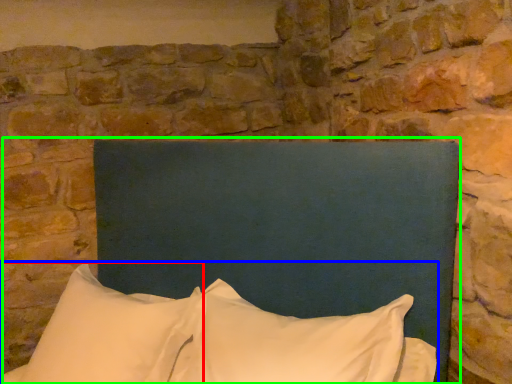
Question: Considering the real-world distances, which object is farthest from pillow (highlighted by a red box)? pillow (highlighted by a blue box) or bed (highlighted by a green box)?

Choices:
 (A) pillow
 (B) bed

Answer: (B)